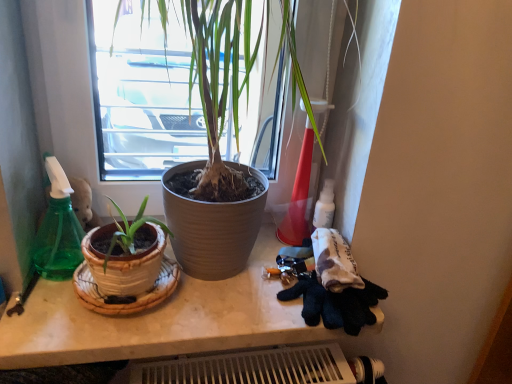
Where is `free space above white marble counter at center (from a real-world perspective)`? The width and height of the screenshot is (512, 384). free space above white marble counter at center (from a real-world perspective) is located at coordinates (210, 291).